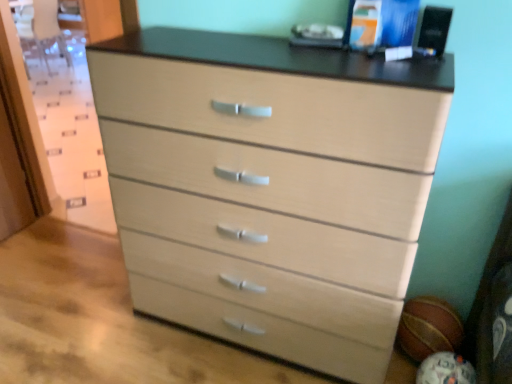
Question: From a real-world perspective, is matte brown basketball at lower right, the 2th basketball positioned from the back, physically located above or below rubber textured basketball at lower right, which is the first basketball from back to front?

Choices:
 (A) above
 (B) below

Answer: (B)

Question: Do you think matte brown basketball at lower right, the first basketball in the front-to-back sequence, is within rubber textured basketball at lower right, which is counted as the second basketball, starting from the front, or outside of it?

Choices:
 (A) outside
 (B) inside

Answer: (A)

Question: Estimate the real-world distances between objects in this image. Which object is farther from the rubber textured basketball at lower right, which is counted as the second basketball, starting from the front?

Choices:
 (A) light wood/texture chest of drawers at center
 (B) matte brown basketball at lower right, the first basketball in the front-to-back sequence

Answer: (A)

Question: Which object is positioned farthest from the matte brown basketball at lower right, the first basketball in the front-to-back sequence?

Choices:
 (A) rubber textured basketball at lower right, which is the first basketball from back to front
 (B) light wood/texture chest of drawers at center

Answer: (B)